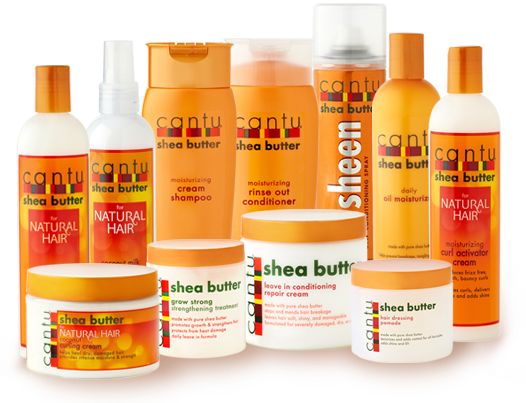
You are a GUI agent. You are given a task and a screenshot of the screen. Output one action in this format:
    pyautogui.click(x=<x>, y=<y>)
    Task: Click on the white and clear containers
    
    Given the screenshot: What is the action you would take?
    pyautogui.click(x=470, y=111), pyautogui.click(x=60, y=140), pyautogui.click(x=108, y=136), pyautogui.click(x=34, y=309), pyautogui.click(x=203, y=351), pyautogui.click(x=295, y=340), pyautogui.click(x=426, y=324)